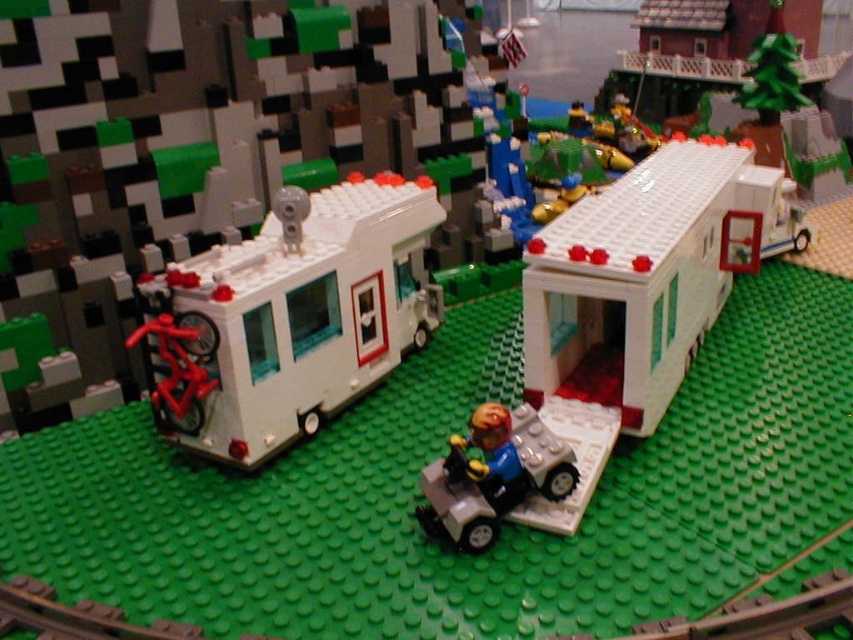
You are a Lego figure trying to decide which vehicle to take for a trip. The white plastic camper at left and the light gray plastic car at center are both available. If you want a wider vehicle for more space, which one should you choose?

The white plastic camper at left is wider than the light gray plastic car at center, so you should choose the white plastic camper at left for more space.

You are a Lego figure standing on the green baseplate. You need to place a new Lego piece that is 3 inches tall. Which object, the white plastic camper at left or the light gray plastic car at center, would allow you to place the new piece on top without it falling off?

The white plastic camper at left is much taller than the light gray plastic car at center, so placing the new piece on top of the white plastic camper at left would be more stable and less likely to fall off.